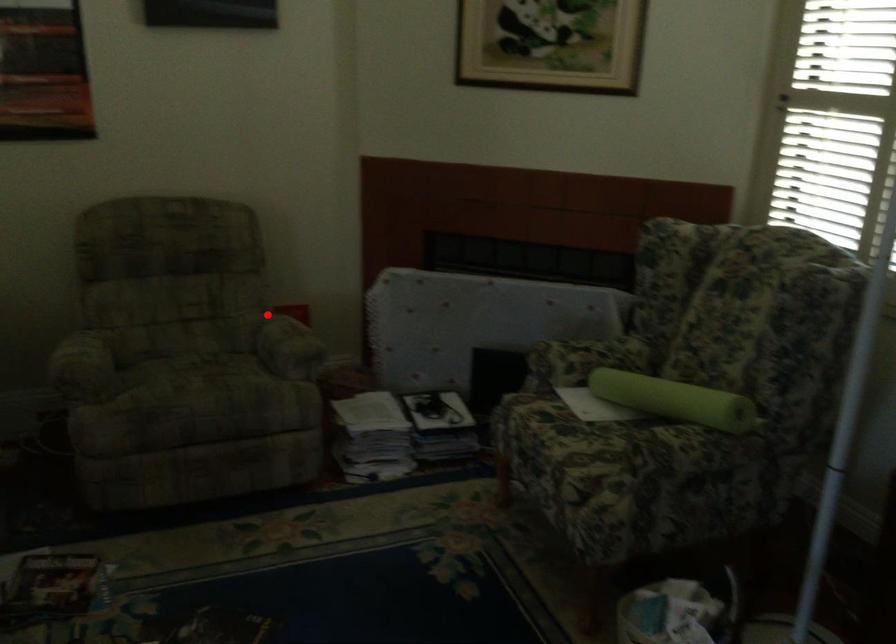
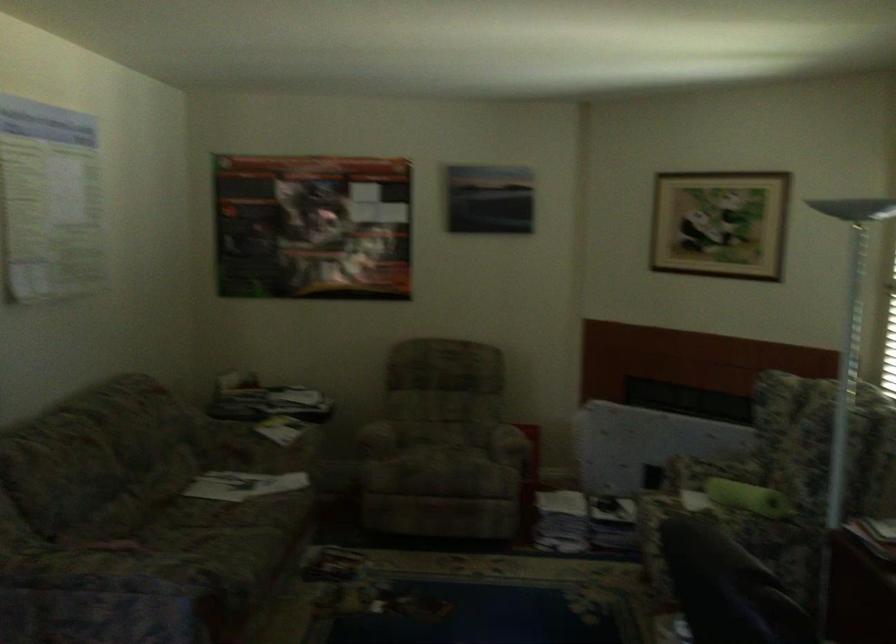
Locate, in the second image, the point that corresponds to the highlighted location in the first image.

(506, 424)